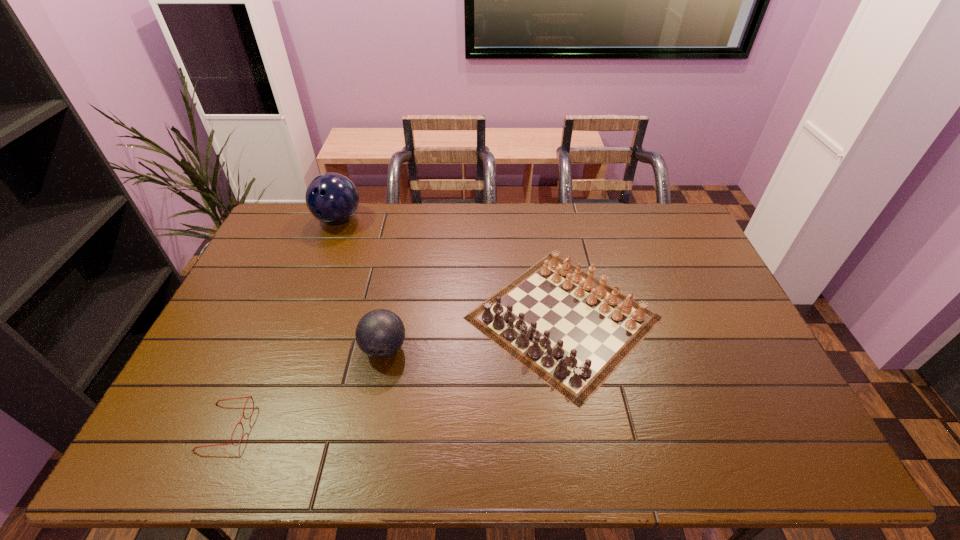
In the image, there is a desktop. Where is `vacant space at the right edge`? The width and height of the screenshot is (960, 540). vacant space at the right edge is located at coordinates [679, 245].

Identify the location of blank region between the nearer bowling ball and the spectacles. The height and width of the screenshot is (540, 960). (305, 388).

Where is `free space between the shortest object and the farther bowling ball`? The height and width of the screenshot is (540, 960). free space between the shortest object and the farther bowling ball is located at coordinates (282, 323).

Image resolution: width=960 pixels, height=540 pixels. What are the coordinates of `vacant area between the rightmost object and the spectacles` in the screenshot? It's located at (395, 372).

Locate an element on the screen. free point between the shortest object and the chessboard is located at coordinates (395, 372).

Locate an element on the screen. This screenshot has width=960, height=540. free space between the spectacles and the chessboard is located at coordinates (395, 372).

Locate an element on the screen. The height and width of the screenshot is (540, 960). vacant area that lies between the second object from right to left and the farther bowling ball is located at coordinates (361, 284).

Where is `empty location between the spectacles and the tallest object`? The height and width of the screenshot is (540, 960). empty location between the spectacles and the tallest object is located at coordinates (282, 323).

Identify the location of unoccupied position between the rightmost object and the third shortest object. (473, 333).

Where is `empty location between the spectacles and the third object from left to right`? The height and width of the screenshot is (540, 960). empty location between the spectacles and the third object from left to right is located at coordinates (305, 388).